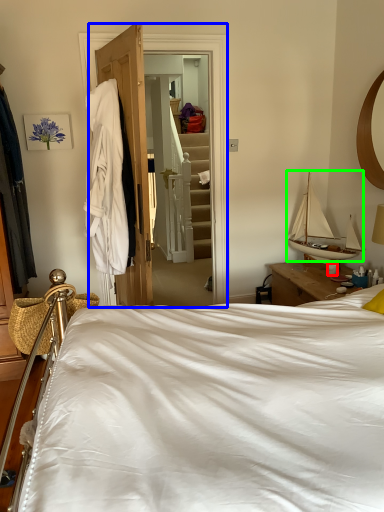
Question: Which object is positioned farthest from coffee cup (highlighted by a red box)? Select from closet (highlighted by a blue box) and boat (highlighted by a green box).

Choices:
 (A) closet
 (B) boat

Answer: (A)